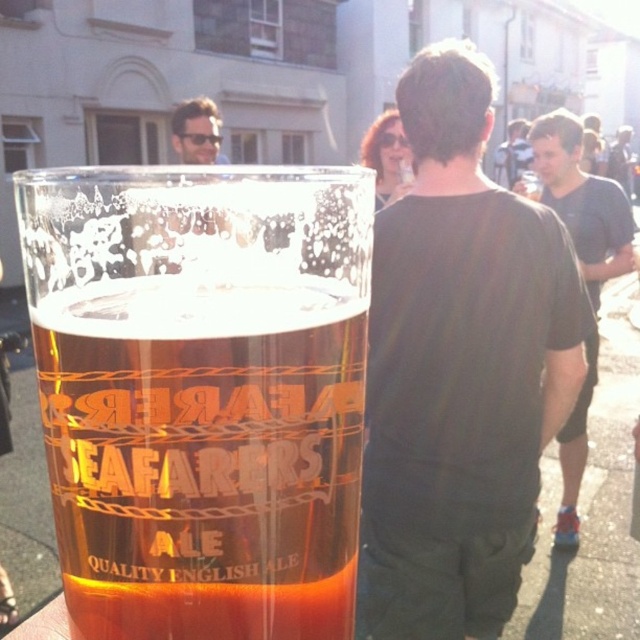
Question: Does translucent glass mug at center appear on the left side of dark gray t-shirt at center?

Choices:
 (A) yes
 (B) no

Answer: (A)

Question: Which is nearer to the dark brown leather jacket at upper center?

Choices:
 (A) black matte shirt at center
 (B) translucent glass mug at center

Answer: (A)

Question: Does translucent glass mug at center have a larger size compared to dark gray t-shirt at center?

Choices:
 (A) no
 (B) yes

Answer: (A)

Question: Does translucent glass mug at center appear over dark gray t-shirt at center?

Choices:
 (A) no
 (B) yes

Answer: (A)

Question: Among these objects, which one is farthest from the camera?

Choices:
 (A) dark gray t-shirt at center
 (B) dark brown leather jacket at upper center
 (C) translucent glass mug at center

Answer: (B)

Question: Among these points, which one is farthest from the camera?

Choices:
 (A) (481, 632)
 (B) (600, 188)
 (C) (312, 374)

Answer: (B)